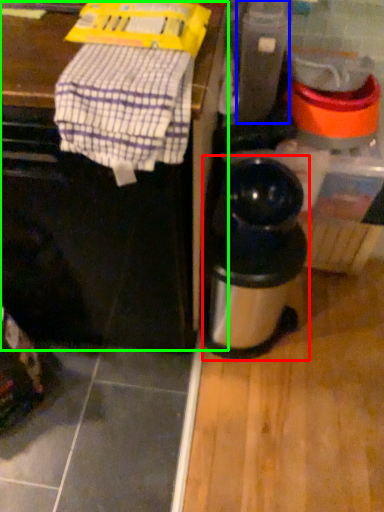
Question: Considering the real-world distances, which object is farthest from kitchen appliance (highlighted by a red box)? appliance (highlighted by a blue box) or vanity (highlighted by a green box)?

Choices:
 (A) appliance
 (B) vanity

Answer: (A)